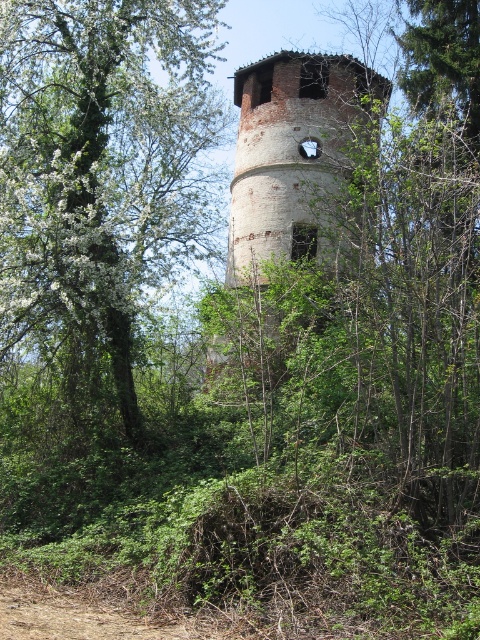
Can you confirm if green leafy tree at center is wider than brick tower at center?

In fact, green leafy tree at center might be narrower than brick tower at center.

In the scene shown: Can you confirm if green leafy tree at center is thinner than brick tower at center?

Indeed, green leafy tree at center has a lesser width compared to brick tower at center.

Who is more distant from viewer, (113, 1) or (337, 170)?

Positioned behind is point (337, 170).

The image size is (480, 640). Identify the location of green leafy tree at center. (99, 177).